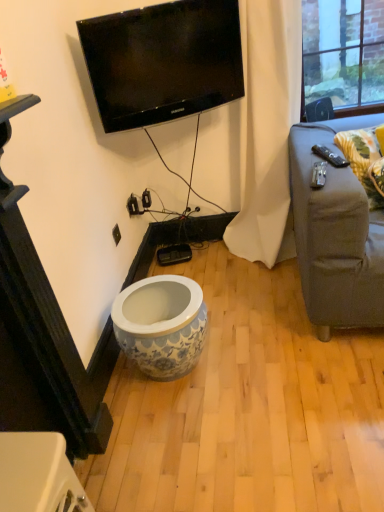
Question: Does point (284, 257) appear closer or farther from the camera than point (122, 109)?

Choices:
 (A) closer
 (B) farther

Answer: (B)

Question: Is white fabric curtain at center wider or thinner than black glossy tv at upper center?

Choices:
 (A) wide
 (B) thin

Answer: (A)

Question: Estimate the real-world distances between objects in this image. Which object is closer to the black glossy tv at upper center?

Choices:
 (A) white fabric curtain at center
 (B) yellow floral fabric pillow at right
 (C) blue and white ceramic vase at center

Answer: (A)

Question: Considering the real-world distances, which object is closest to the black glossy tv at upper center?

Choices:
 (A) white fabric curtain at center
 (B) yellow floral fabric pillow at right
 (C) blue and white ceramic vase at center

Answer: (A)